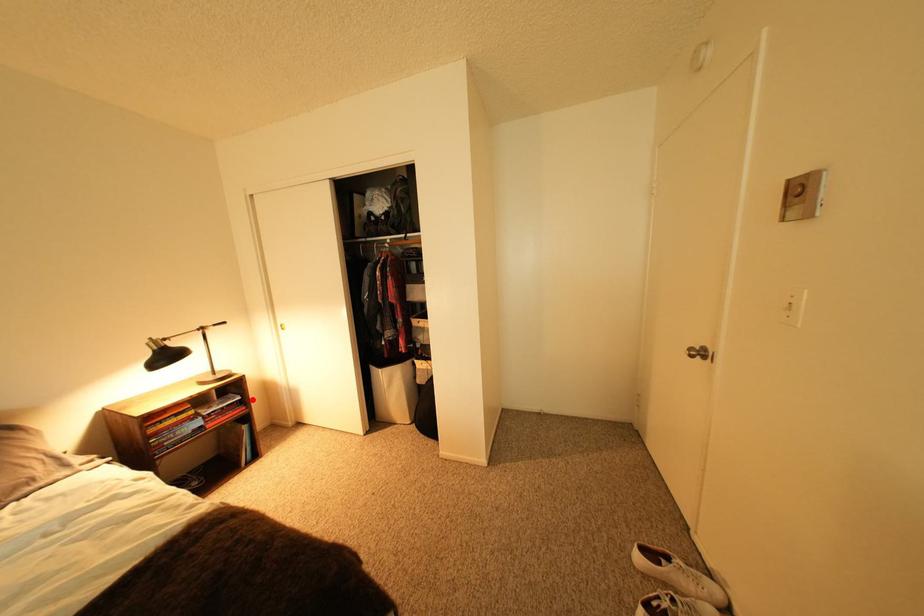
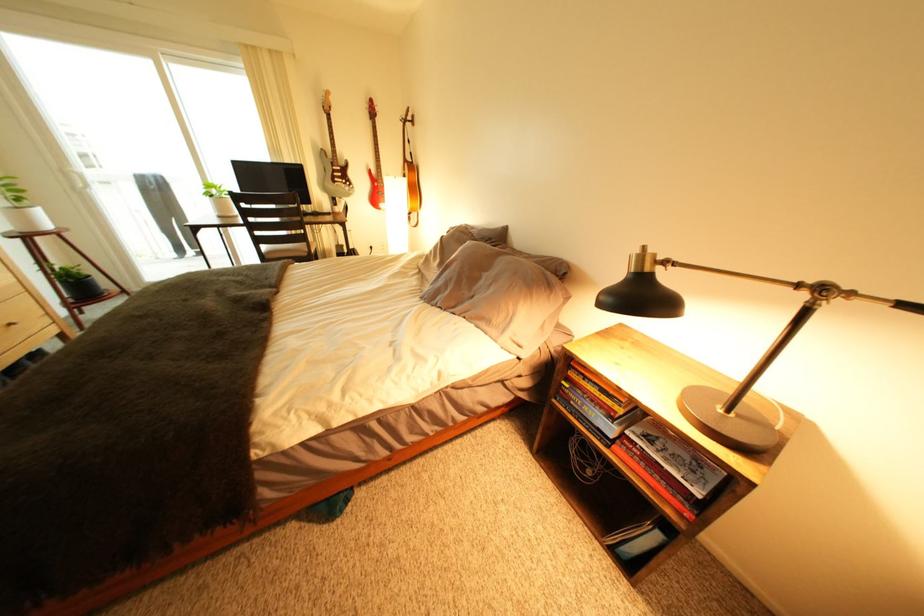
Question: I am providing you with two images of the same scene from different viewpoints. A red point is shown in image1. For the corresponding object point in image2, is it positioned nearer or farther from the camera?

Choices:
 (A) Nearer
 (B) Farther

Answer: (B)